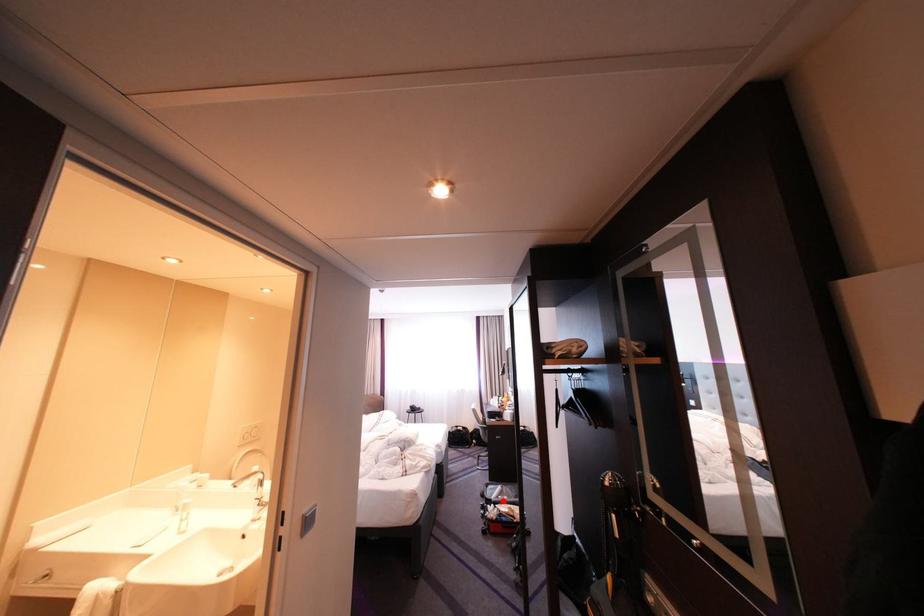
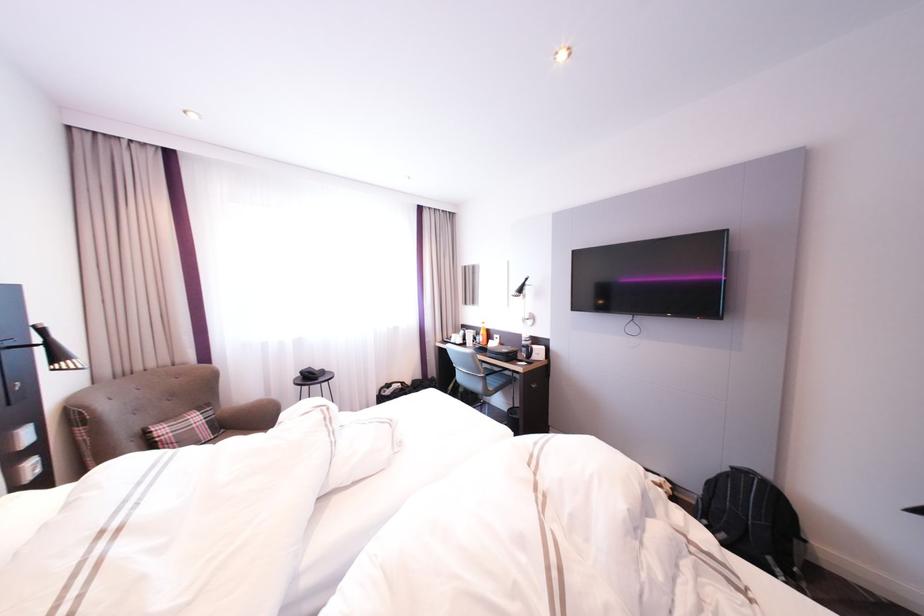
Question: I am providing you with two images of the same scene from different viewpoints. A red point is marked on the first image. Can you still see the location of the red point in image 2?

Choices:
 (A) Yes
 (B) No

Answer: (B)